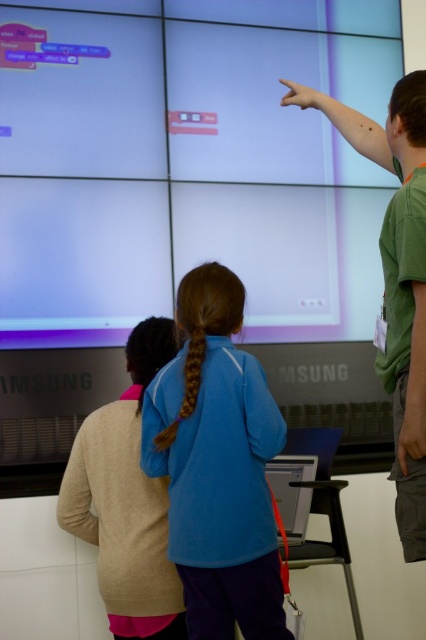
You are a technician who needs to adjust the distance between the matte white projection screen at upper center and the matte black monitor at center to 5 feet. Based on the current setup, how much more space do you need to add?

The current distance between the matte white projection screen at upper center and the matte black monitor at center is 4.29 feet. To reach 5 feet, you need to add an additional 0.71 feet of space between them.

You are a student in a classroom with a matte white projection screen at upper center and a matte black monitor at center. Your teacher asks you to compare their sizes. Which one is wider?

The matte white projection screen at upper center is wider than the matte black monitor at center because its width surpasses the monitor.

You are a photographer setting up a shoot in the scene. You need to place a light so that it illuminates both the blue fleece jacket at center and the beige sweater at lower left without casting harsh shadows. Considering their heights, where should you position the light?

The blue fleece jacket at center is taller than the beige sweater at lower left. To avoid harsh shadows, position the light above and slightly behind the blue fleece jacket at center, ensuring it reaches both subjects evenly.